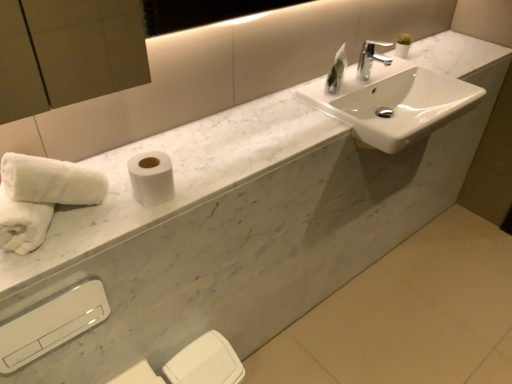
Question: From the image's perspective, is green glass vase at upper center located beneath white matte toilet paper at lower center, marked as the second toilet paper in a front-to-back arrangement?

Choices:
 (A) no
 (B) yes

Answer: (A)

Question: Is green glass vase at upper center behind white matte toilet paper at lower center, placed as the 1th toilet paper when sorted from bottom to top?

Choices:
 (A) yes
 (B) no

Answer: (A)

Question: Is green glass vase at upper center far away from white matte toilet paper at lower center, marked as the second toilet paper in a front-to-back arrangement?

Choices:
 (A) no
 (B) yes

Answer: (A)

Question: Is white matte toilet paper at lower center, the 2th toilet paper viewed from the top, surrounded by green glass vase at upper center?

Choices:
 (A) no
 (B) yes

Answer: (A)

Question: Are green glass vase at upper center and white matte toilet paper at lower center, marked as the second toilet paper in a front-to-back arrangement, making contact?

Choices:
 (A) yes
 (B) no

Answer: (B)

Question: Relative to white matte toilet paper at lower center, the 2th toilet paper viewed from the top, is green glass vase at upper center in front or behind?

Choices:
 (A) front
 (B) behind

Answer: (B)

Question: Based on their positions, is green glass vase at upper center located to the left or right of white matte toilet paper at lower center, the 2th toilet paper viewed from the top?

Choices:
 (A) left
 (B) right

Answer: (B)

Question: Is green glass vase at upper center taller or shorter than white matte toilet paper at lower center, the 2th toilet paper viewed from the top?

Choices:
 (A) short
 (B) tall

Answer: (A)

Question: From the image's perspective, is green glass vase at upper center above or below white matte toilet paper at lower center, placed as the 1th toilet paper when sorted from bottom to top?

Choices:
 (A) below
 (B) above

Answer: (B)

Question: From their relative heights in the image, would you say white glossy hand dryer at lower left is taller or shorter than white matte toilet paper at lower center, the 2th toilet paper viewed from the top?

Choices:
 (A) short
 (B) tall

Answer: (A)

Question: Is white glossy hand dryer at lower left situated inside white matte toilet paper at lower center, the 2th toilet paper viewed from the top, or outside?

Choices:
 (A) inside
 (B) outside

Answer: (B)

Question: From the image's perspective, is white glossy hand dryer at lower left above or below white matte toilet paper at lower center, the 2th toilet paper viewed from the top?

Choices:
 (A) above
 (B) below

Answer: (A)

Question: In the image, is white glossy hand dryer at lower left positioned in front of or behind white matte toilet paper at lower center, the 2th toilet paper viewed from the top?

Choices:
 (A) front
 (B) behind

Answer: (A)

Question: From the image's perspective, is white glossy sink at upper right above or below white glossy hand dryer at lower left?

Choices:
 (A) above
 (B) below

Answer: (A)

Question: Is point (408, 99) positioned closer to the camera than point (2, 365)?

Choices:
 (A) farther
 (B) closer

Answer: (A)